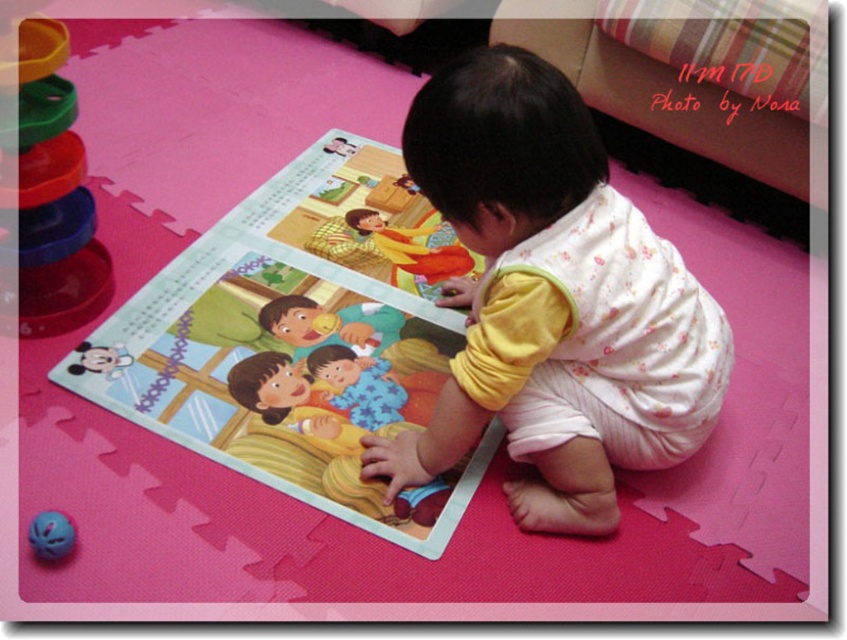
From the picture: You are a parent trying to ensure your child is sitting safely. The pink foam mat at center and the white floral onesie at center are both in view. Which object is taller and could potentially provide better support?

The pink foam mat at center is taller than the white floral onesie at center, so it could provide better support for the child.

You are a parent trying to put away toys. You see the stacked plastic rings at left and the purple rubber ball at lower left. Which toy is closer to the child sitting on the pink interlocking foam mat?

The purple rubber ball at lower left is closer to the child sitting on the pink interlocking foam mat because it is only 21.72 inches away from the stacked plastic rings at left, but the exact distance from the child isn